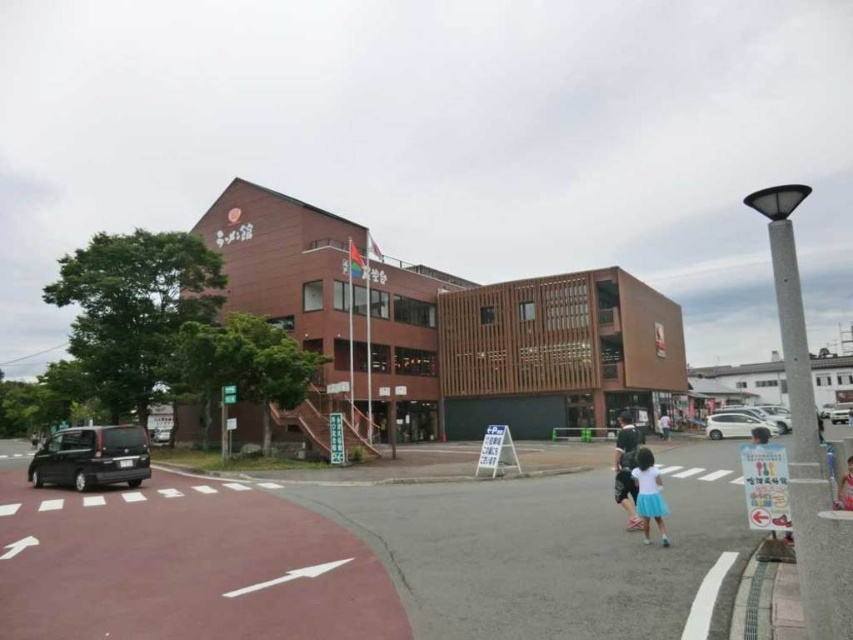
Question: Is shiny black van at lower left below light blue denim shorts at lower right?

Choices:
 (A) yes
 (B) no

Answer: (A)

Question: Which point is closer to the camera?

Choices:
 (A) (650, 454)
 (B) (125, 477)
 (C) (720, 433)
 (D) (848, 500)

Answer: (D)

Question: Which point is closer to the camera?

Choices:
 (A) (645, 452)
 (B) (734, 432)
 (C) (663, 412)

Answer: (A)

Question: Does satin silver sedan at right appear on the right side of white cotton shirt at center?

Choices:
 (A) yes
 (B) no

Answer: (A)

Question: Considering the relative positions of light blue skirt at lower center and white cotton shirt at center in the image provided, where is light blue skirt at lower center located with respect to white cotton shirt at center?

Choices:
 (A) left
 (B) right

Answer: (A)

Question: Which object appears closest to the camera in this image?

Choices:
 (A) shiny black van at lower left
 (B) light blue denim shorts at lower right
 (C) light blue skirt at lower center

Answer: (B)